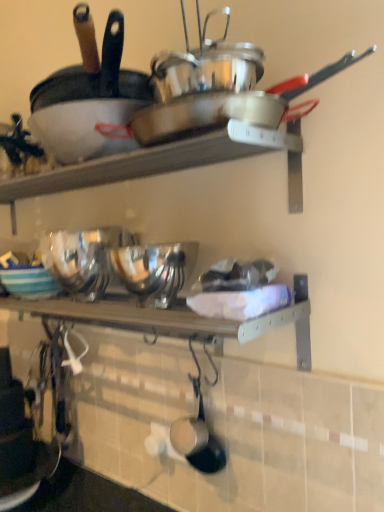
Question: From a real-world perspective, is shiny silver frying pan at lower center, placed as the 2th frying pan when sorted from top to bottom, below shiny silver wok at upper center?

Choices:
 (A) yes
 (B) no

Answer: (A)

Question: Can you confirm if shiny silver frying pan at lower center, placed as the 2th frying pan when sorted from top to bottom, is bigger than shiny silver wok at upper center?

Choices:
 (A) yes
 (B) no

Answer: (B)

Question: Can you confirm if shiny silver frying pan at lower center, the 1th frying pan ordered from the bottom, is taller than shiny silver wok at upper center?

Choices:
 (A) no
 (B) yes

Answer: (B)

Question: Would you say shiny silver frying pan at lower center, placed as the 2th frying pan when sorted from top to bottom, is outside shiny silver wok at upper center?

Choices:
 (A) no
 (B) yes

Answer: (B)

Question: Is shiny silver frying pan at lower center, placed as the 2th frying pan when sorted from top to bottom, not close to shiny silver wok at upper center?

Choices:
 (A) no
 (B) yes

Answer: (A)

Question: Considering their positions, is wooden shelf at center located in front of or behind matte black frying pan at upper left, the 1th frying pan from the top?

Choices:
 (A) behind
 (B) front

Answer: (A)

Question: Is wooden shelf at center bigger or smaller than matte black frying pan at upper left, arranged as the 2th frying pan when ordered from the bottom?

Choices:
 (A) small
 (B) big

Answer: (A)

Question: Do you think wooden shelf at center is within matte black frying pan at upper left, arranged as the 2th frying pan when ordered from the bottom, or outside of it?

Choices:
 (A) outside
 (B) inside

Answer: (A)

Question: Is wooden shelf at center wider or thinner than matte black frying pan at upper left, the 1th frying pan from the top?

Choices:
 (A) thin
 (B) wide

Answer: (A)

Question: Considering the positions of striped ceramic bowl at center and shiny silver wok at upper center in the image, is striped ceramic bowl at center bigger or smaller than shiny silver wok at upper center?

Choices:
 (A) big
 (B) small

Answer: (B)

Question: In the image, is striped ceramic bowl at center positioned in front of or behind shiny silver wok at upper center?

Choices:
 (A) behind
 (B) front

Answer: (A)

Question: From the image's perspective, relative to shiny silver wok at upper center, is striped ceramic bowl at center above or below?

Choices:
 (A) above
 (B) below

Answer: (B)

Question: Considering the positions of striped ceramic bowl at center and shiny silver wok at upper center in the image, is striped ceramic bowl at center taller or shorter than shiny silver wok at upper center?

Choices:
 (A) short
 (B) tall

Answer: (B)

Question: From the image's perspective, is matte black frying pan at upper left, arranged as the 2th frying pan when ordered from the bottom, above or below striped ceramic bowl at center?

Choices:
 (A) below
 (B) above

Answer: (B)

Question: Relative to striped ceramic bowl at center, is matte black frying pan at upper left, the 1th frying pan from the top, in front or behind?

Choices:
 (A) front
 (B) behind

Answer: (A)